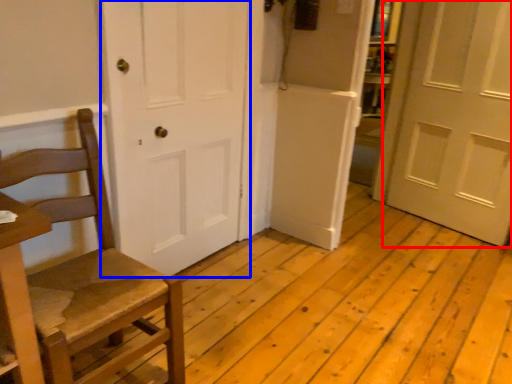
Question: Which object appears closest to the camera in this image, door (highlighted by a red box) or door (highlighted by a blue box)?

Choices:
 (A) door
 (B) door

Answer: (B)